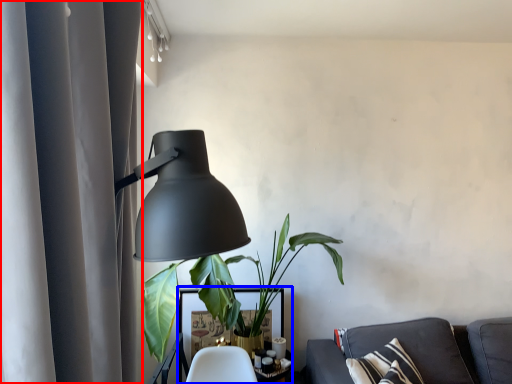
Question: Which object is closer to the camera taking this photo, curtain (highlighted by a red box) or table (highlighted by a blue box)?

Choices:
 (A) curtain
 (B) table

Answer: (A)